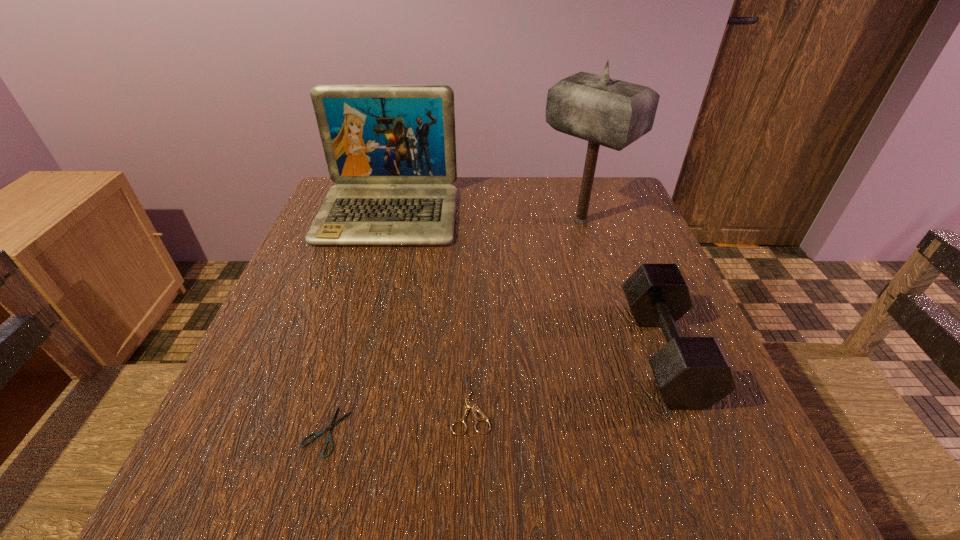
Identify the location of vacant area located 0.350m on the right of the second shortest object. This screenshot has height=540, width=960. (712, 403).

You are a GUI agent. You are given a task and a screenshot of the screen. Output one action in this format:
    pyautogui.click(x=<x>, y=<y>)
    Task: Click on the vacant region located on the right of the shortest object
    The height and width of the screenshot is (540, 960).
    Given the screenshot: What is the action you would take?
    pyautogui.click(x=420, y=431)

Identify the location of mallet present at the far edge. This screenshot has width=960, height=540. (604, 111).

In order to click on laptop computer that is at the far edge in this screenshot , I will do `click(391, 149)`.

This screenshot has height=540, width=960. I want to click on object that is at the near edge, so click(330, 428).

Image resolution: width=960 pixels, height=540 pixels. What are the coordinates of `laptop computer situated at the left edge` in the screenshot? It's located at (391, 149).

The image size is (960, 540). Find the location of `shears located at the left edge`. shears located at the left edge is located at coordinates (330, 428).

I want to click on mallet that is at the right edge, so click(x=604, y=111).

Find the location of `dumbbell that is positioned at the right edge`. dumbbell that is positioned at the right edge is located at coordinates (692, 373).

You are a GUI agent. You are given a task and a screenshot of the screen. Output one action in this format:
    pyautogui.click(x=<x>, y=<y>)
    Task: Click on the object at the far left corner
    The image size is (960, 540).
    Given the screenshot: What is the action you would take?
    pyautogui.click(x=391, y=149)